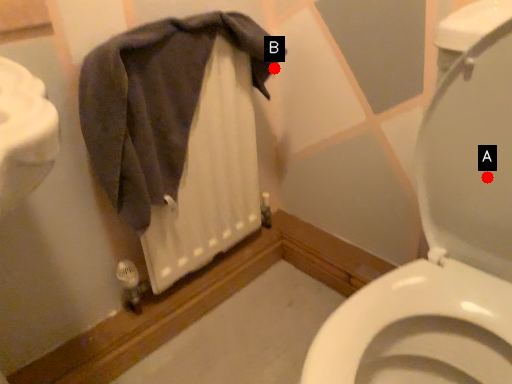
Question: Two points are circled on the image, labeled by A and B beside each circle. Which point appears closest to the camera in this image?

Choices:
 (A) A is closer
 (B) B is closer

Answer: (A)